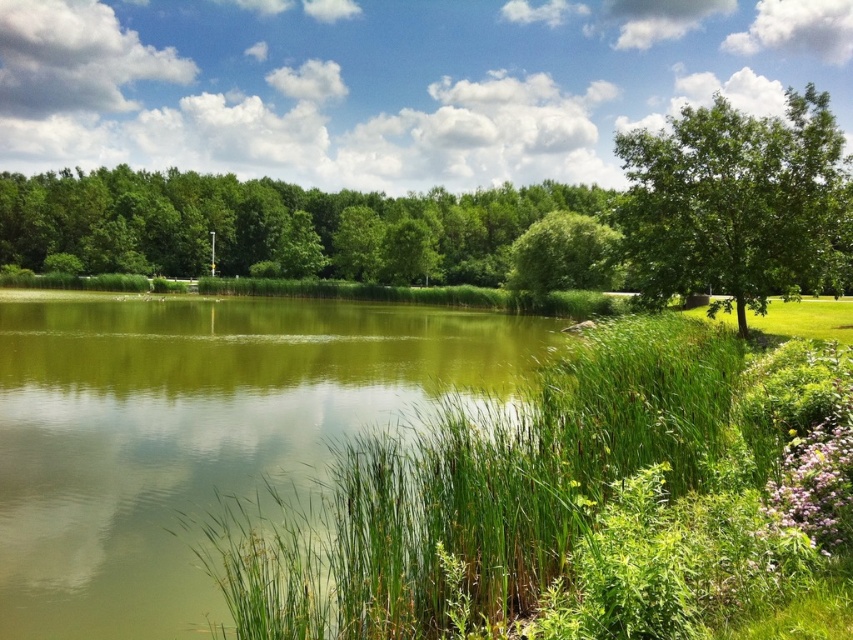
Question: Based on their relative distances, which object is nearer to the green grassy water at center?

Choices:
 (A) green grass at center
 (B) green leafy tree at upper center
 (C) green leafy tree at upper right

Answer: (A)

Question: Which point is farther from the camera taking this photo?

Choices:
 (A) (573, 220)
 (B) (102, 476)
 (C) (625, 404)

Answer: (A)

Question: Can you confirm if green grass at center is positioned above green leafy tree at upper center?

Choices:
 (A) yes
 (B) no

Answer: (B)

Question: Is green grass at center positioned at the back of green leafy tree at upper center?

Choices:
 (A) yes
 (B) no

Answer: (B)

Question: Which of these objects is positioned closest to the green leafy tree at upper right?

Choices:
 (A) green leafy tree at center
 (B) green leafy tree at upper center
 (C) green grassy water at center
 (D) green grass at center

Answer: (D)

Question: Is green grass at center wider than green leafy tree at upper right?

Choices:
 (A) no
 (B) yes

Answer: (B)